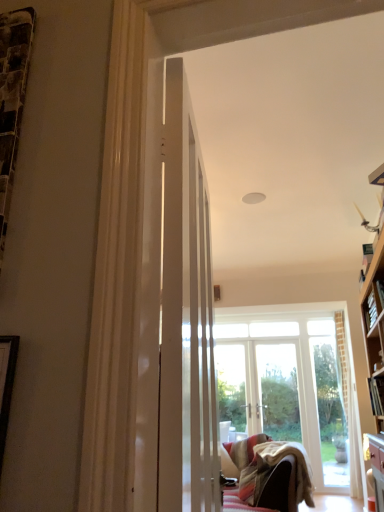
Question: Is hardcover book at right, placed as the 1th book when sorted from bottom to top, placed right next to wooden bookshelf at right, which appears as the second book when viewed from the front?

Choices:
 (A) yes
 (B) no

Answer: (B)

Question: Is hardcover book at right, which is counted as the first book, starting from the front, taller than wooden bookshelf at right, which is the 2th book in bottom-to-top order?

Choices:
 (A) yes
 (B) no

Answer: (B)

Question: From a real-world perspective, is hardcover book at right, which is counted as the first book, starting from the front, physically above wooden bookshelf at right, the first book viewed from the back?

Choices:
 (A) yes
 (B) no

Answer: (B)

Question: Can you confirm if hardcover book at right, which ranks as the 2th book in back-to-front order, is positioned to the left of wooden bookshelf at right, positioned as the 1th book in top-to-bottom order?

Choices:
 (A) yes
 (B) no

Answer: (A)

Question: Is hardcover book at right, which ranks as the 2th book in back-to-front order, oriented towards wooden bookshelf at right, which appears as the second book when viewed from the front?

Choices:
 (A) yes
 (B) no

Answer: (B)

Question: Is hardcover book at right, which ranks as the second book in top-to-bottom order, looking in the opposite direction of wooden bookshelf at right, which appears as the second book when viewed from the front?

Choices:
 (A) yes
 (B) no

Answer: (B)

Question: Is hardcover book at right, which ranks as the second book in top-to-bottom order, not within velvet beige couch at lower center?

Choices:
 (A) yes
 (B) no

Answer: (A)

Question: Considering the relative sizes of hardcover book at right, which ranks as the second book in top-to-bottom order, and velvet beige couch at lower center in the image provided, is hardcover book at right, which ranks as the second book in top-to-bottom order, shorter than velvet beige couch at lower center?

Choices:
 (A) yes
 (B) no

Answer: (A)

Question: From a real-world perspective, is hardcover book at right, which ranks as the second book in top-to-bottom order, over velvet beige couch at lower center?

Choices:
 (A) no
 (B) yes

Answer: (B)

Question: Are hardcover book at right, which ranks as the 2th book in back-to-front order, and velvet beige couch at lower center beside each other?

Choices:
 (A) yes
 (B) no

Answer: (B)

Question: From a real-world perspective, is hardcover book at right, which is counted as the first book, starting from the front, below velvet beige couch at lower center?

Choices:
 (A) no
 (B) yes

Answer: (A)

Question: Is hardcover book at right, which is counted as the first book, starting from the front, positioned behind velvet beige couch at lower center?

Choices:
 (A) yes
 (B) no

Answer: (B)

Question: Considering the relative sizes of velvet beige couch at lower center and white glossy door at center in the image provided, is velvet beige couch at lower center wider than white glossy door at center?

Choices:
 (A) no
 (B) yes

Answer: (B)